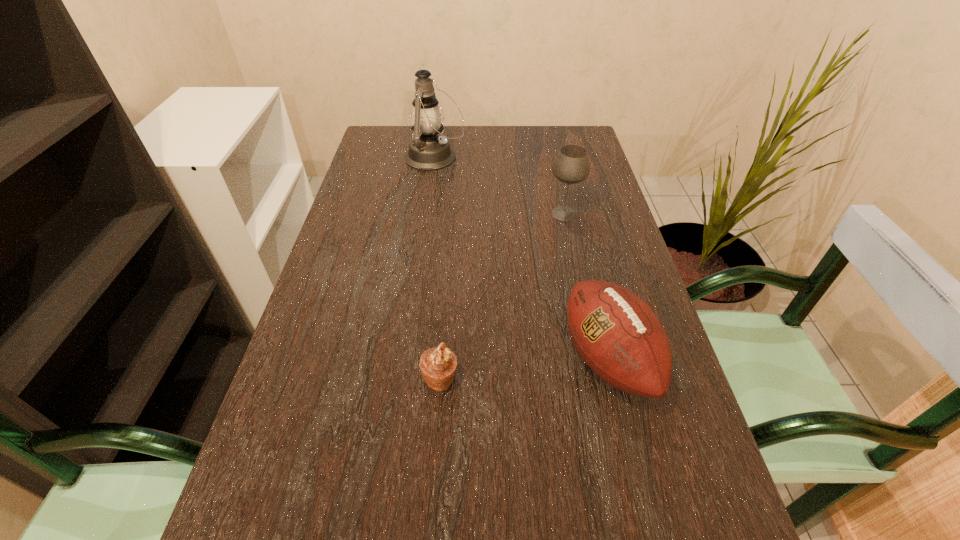
The height and width of the screenshot is (540, 960). In order to click on object at the far edge in this screenshot , I will do `click(428, 151)`.

This screenshot has height=540, width=960. What are the coordinates of `object that is at the left edge` in the screenshot? It's located at (428, 151).

Where is `wineglass that is at the right edge`? Image resolution: width=960 pixels, height=540 pixels. wineglass that is at the right edge is located at coordinates (571, 166).

Image resolution: width=960 pixels, height=540 pixels. I want to click on football (American) located at the right edge, so (x=614, y=331).

This screenshot has width=960, height=540. I want to click on object that is at the far left corner, so (x=428, y=151).

At what (x,y) coordinates should I click in order to perform the action: click on vacant space at the far edge. Please return your answer as a coordinate pair (x, y). Looking at the image, I should click on (538, 131).

In the image, there is a desktop. At what (x,y) coordinates should I click in order to perform the action: click on free region at the left edge. Please return your answer as a coordinate pair (x, y). Looking at the image, I should click on (326, 298).

Image resolution: width=960 pixels, height=540 pixels. I want to click on vacant space at the right edge of the desktop, so click(665, 516).

Where is `free spot between the oil lamp and the third tallest object`? The image size is (960, 540). free spot between the oil lamp and the third tallest object is located at coordinates coord(521,258).

Locate an element on the screen. Image resolution: width=960 pixels, height=540 pixels. blank region between the muffin and the third shortest object is located at coordinates (502, 296).